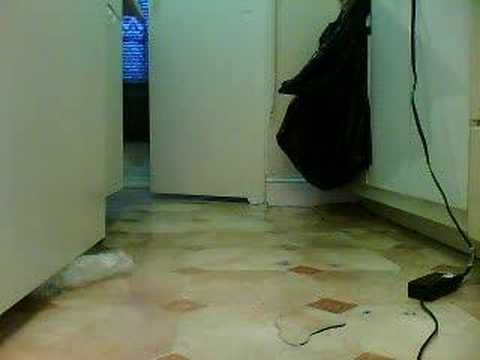
I want to click on floor where there is nothing on it, so click(x=202, y=333).